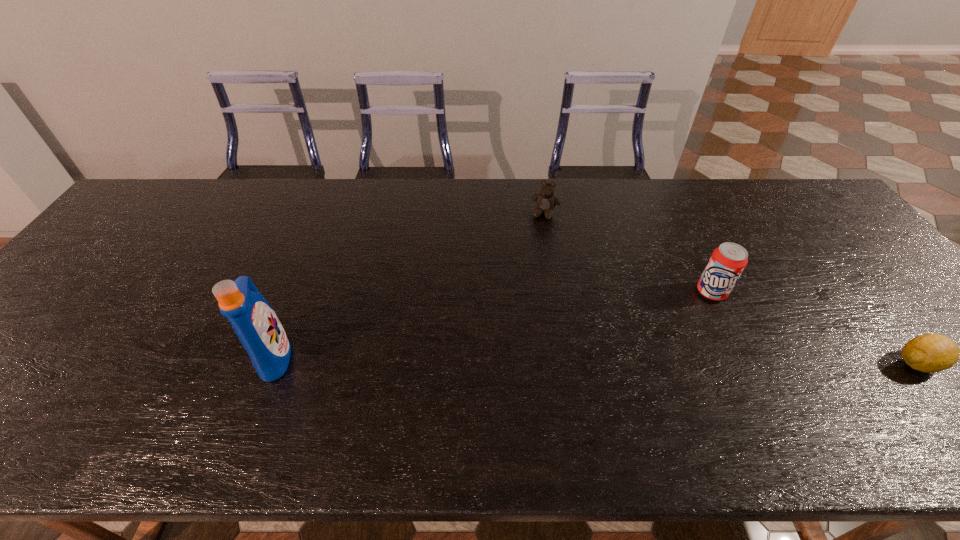
Locate an element on the screen. This screenshot has width=960, height=540. vacant area between the second shortest object and the detergent is located at coordinates 410,285.

Locate an element on the screen. empty space between the tallest object and the second object from right to left is located at coordinates (493, 323).

Where is `free space between the shortest object and the soda can`? The image size is (960, 540). free space between the shortest object and the soda can is located at coordinates (815, 327).

Where is `vacant region between the tallest object and the soda can`? vacant region between the tallest object and the soda can is located at coordinates (493, 323).

The width and height of the screenshot is (960, 540). I want to click on object that is the third closest to the teddy bear, so 930,353.

Locate which object ranks third in proximity to the lemon. Please provide its 2D coordinates. Your answer should be formatted as a tuple, i.e. [(x, y)], where the tuple contains the x and y coordinates of a point satisfying the conditions above.

[(257, 326)]

Where is `vacant space that satisfies the following two spatial constraints: 1. on the front side of the rightmost object; 2. at the stem end of the second object from left to right`? vacant space that satisfies the following two spatial constraints: 1. on the front side of the rightmost object; 2. at the stem end of the second object from left to right is located at coordinates (570, 363).

I want to click on vacant space that satisfies the following two spatial constraints: 1. on the front side of the rightmost object; 2. at the stem end of the farthest object, so click(x=570, y=363).

Locate an element on the screen. The height and width of the screenshot is (540, 960). vacant space that satisfies the following two spatial constraints: 1. on the front side of the soda can; 2. on the left side of the teddy bear is located at coordinates (559, 292).